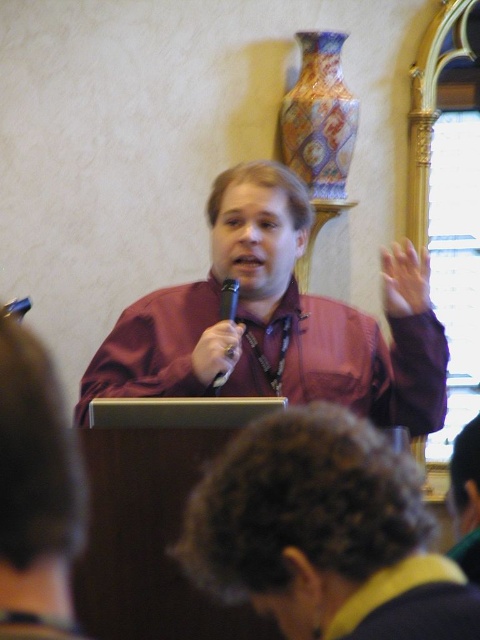
Does satin burgundy shirt at center appear on the right side of black metallic microphone at center?

Yes, satin burgundy shirt at center is to the right of black metallic microphone at center.

Is point (314, 392) positioned behind point (228, 289)?

Yes, it is.

Which is behind, point (133, 353) or point (226, 308)?

Point (133, 353)

You are a GUI agent. You are given a task and a screenshot of the screen. Output one action in this format:
    pyautogui.click(x=<x>, y=<y>)
    Task: Click on the satin burgundy shirt at center
    Image resolution: width=480 pixels, height=640 pixels.
    Given the screenshot: What is the action you would take?
    pyautogui.click(x=273, y=323)

Which is more to the left, matte skin hand at upper right or matte black microphone at center?

Positioned to the left is matte black microphone at center.

Can you confirm if matte skin hand at upper right is positioned to the left of matte black microphone at center?

Incorrect, matte skin hand at upper right is not on the left side of matte black microphone at center.

Who is more forward, (411, 252) or (232, 360)?

Point (411, 252) is in front.

Find the location of a particular element. matte skin hand at upper right is located at coordinates (405, 280).

Describe the element at coordinates (36, 492) in the screenshot. I see `matte maroon shirt at center` at that location.

Does matte maroon shirt at center appear on the left side of matte skin hand at upper right?

Correct, you'll find matte maroon shirt at center to the left of matte skin hand at upper right.

Is point (71, 460) positioned behind point (424, 266)?

No, it is in front of (424, 266).

Locate an element on the screen. The width and height of the screenshot is (480, 640). matte maroon shirt at center is located at coordinates (36, 492).